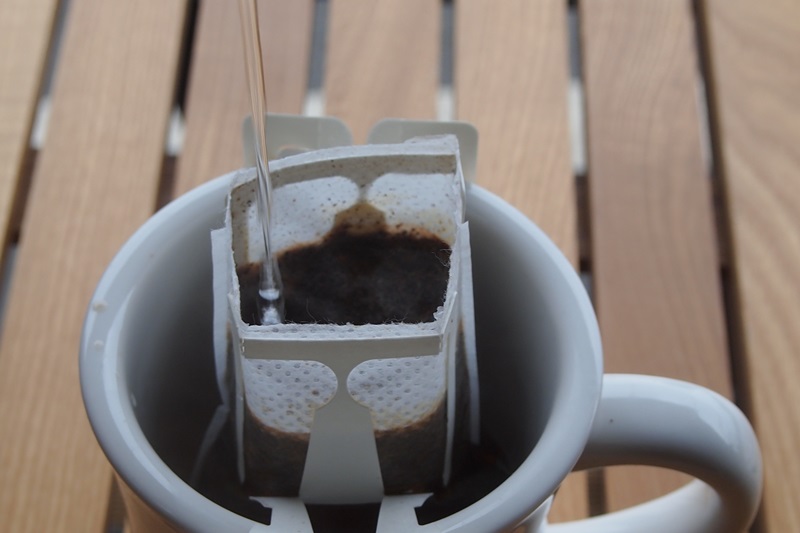
The image size is (800, 533). I want to click on mug handle, so click(653, 425), click(706, 444), click(666, 506).